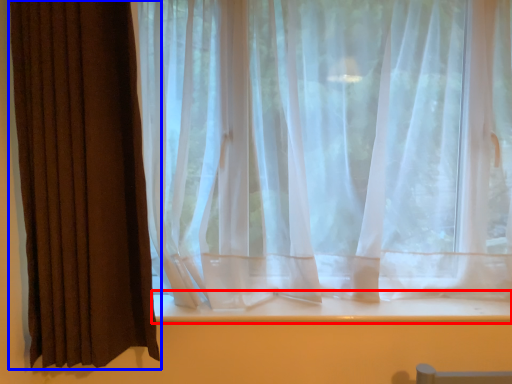
Question: Which object appears farthest to the camera in this image, window sill (highlighted by a red box) or curtain (highlighted by a blue box)?

Choices:
 (A) window sill
 (B) curtain

Answer: (A)